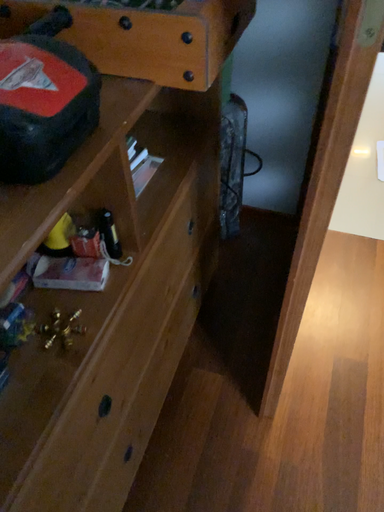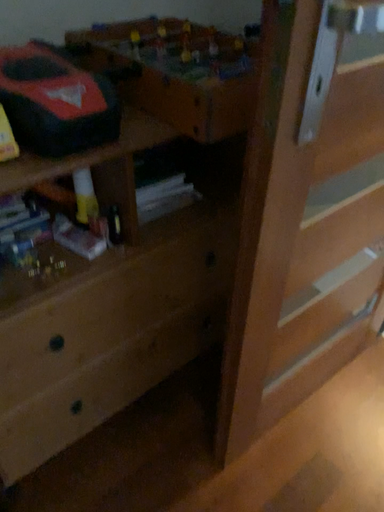
Question: Which way did the camera rotate in the video?

Choices:
 (A) rotated upward
 (B) rotated downward

Answer: (A)